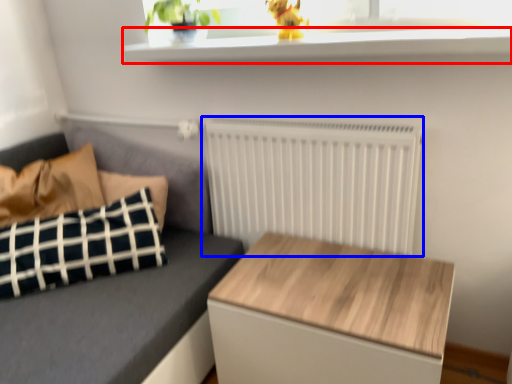
Question: Which of the following is the farthest to the observer, window sill (highlighted by a red box) or radiator (highlighted by a blue box)?

Choices:
 (A) window sill
 (B) radiator

Answer: (B)